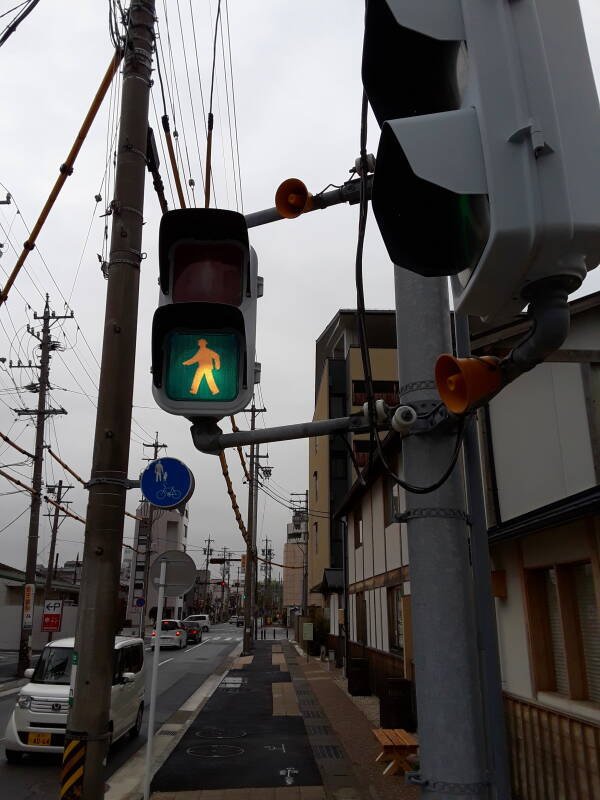
Image resolution: width=600 pixels, height=800 pixels. I want to click on cable, so click(231, 500).